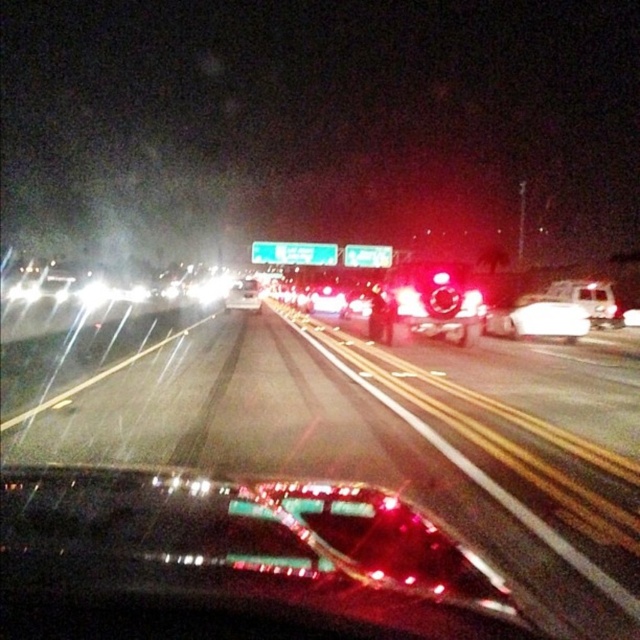
Question: Which object is closer to the camera taking this photo?

Choices:
 (A) glossy reflective car at center
 (B) metallic silver car at center

Answer: (A)

Question: Which object is farther from the camera taking this photo?

Choices:
 (A) metallic silver ambulance at right
 (B) glossy plastic car at center

Answer: (A)

Question: Does glossy reflective car at center appear on the left side of glossy plastic car at center?

Choices:
 (A) no
 (B) yes

Answer: (A)

Question: Which point is closer to the camera?

Choices:
 (A) glossy plastic car at center
 (B) metallic silver car at center
 (C) glossy reflective car at center
 (D) metallic silver ambulance at right

Answer: (A)

Question: From the image, what is the correct spatial relationship of glossy plastic car at center in relation to metallic silver ambulance at right?

Choices:
 (A) left
 (B) right

Answer: (A)

Question: Observing the image, what is the correct spatial positioning of glossy plastic car at center in reference to metallic silver car at center?

Choices:
 (A) right
 (B) left

Answer: (A)